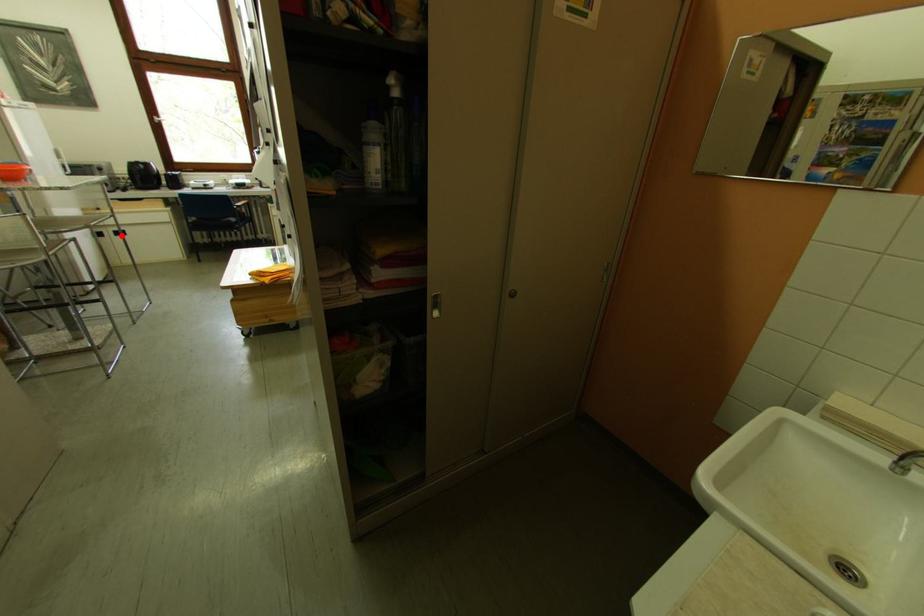
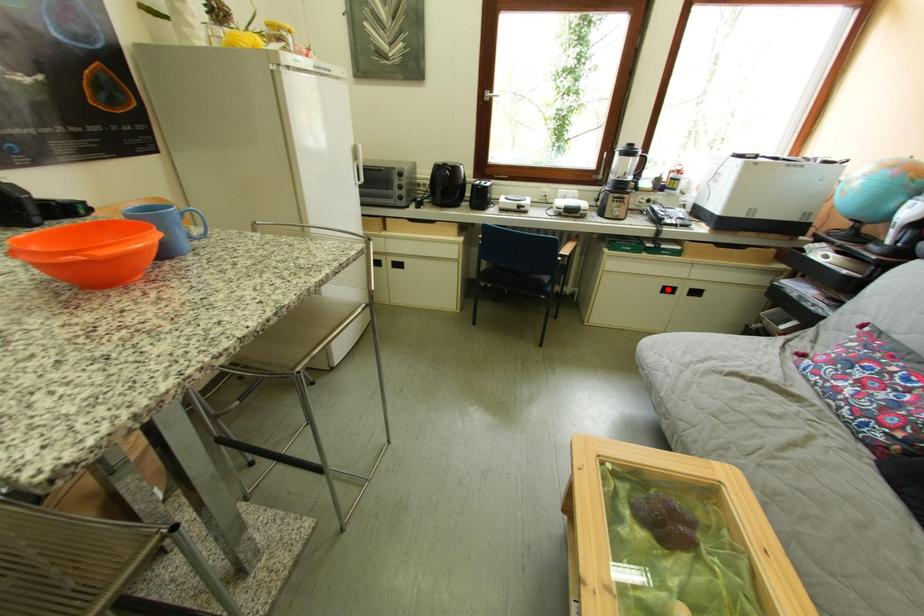
I am providing you with two images of the same scene from different viewpoints. A red point is marked on the first image and another point is marked on the second image. Are the points marked in image1 and image2 representing the same 3D position?

No